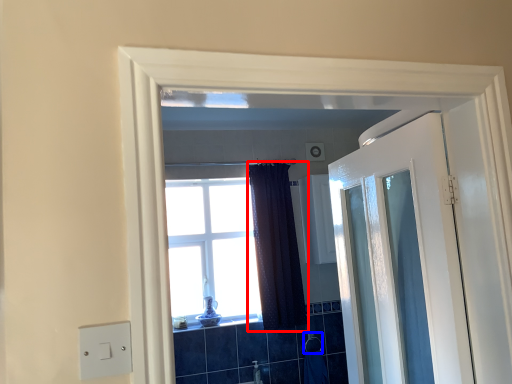
Question: Which object is closer to the camera taking this photo, curtain (highlighted by a red box) or towel bar (highlighted by a blue box)?

Choices:
 (A) curtain
 (B) towel bar

Answer: (A)